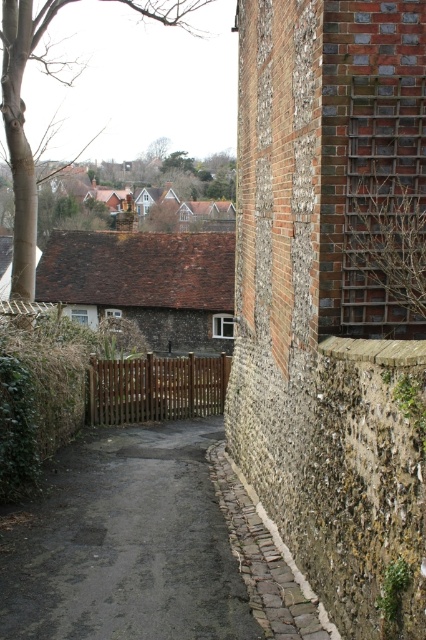
You are a delivery person with a cart that requires a 60 feet clearance to maneuver. You need to navigate through the alleyway between the bare branches at upper left and the brown wooden gate at center. Can your cart safely pass through this space?

The distance between the bare branches at upper left and the brown wooden gate at center is 64.58 feet, which is greater than the required 60 feet clearance. Therefore, the cart can safely pass through the space between them.

You are a delivery robot with a 2 meter long package. You need to navigate through the narrow alleyway shown in the image. There is a brown cobblestone path at lower center and a brown wooden gate at center. Can you safely pass through the alleyway while carrying the package without hitting the gate or the path?

The brown cobblestone path at lower center and brown wooden gate at center are 7.76 meters apart from each other. Since the package is only 2 meters long, there is sufficient space between them to navigate safely without any collisions.